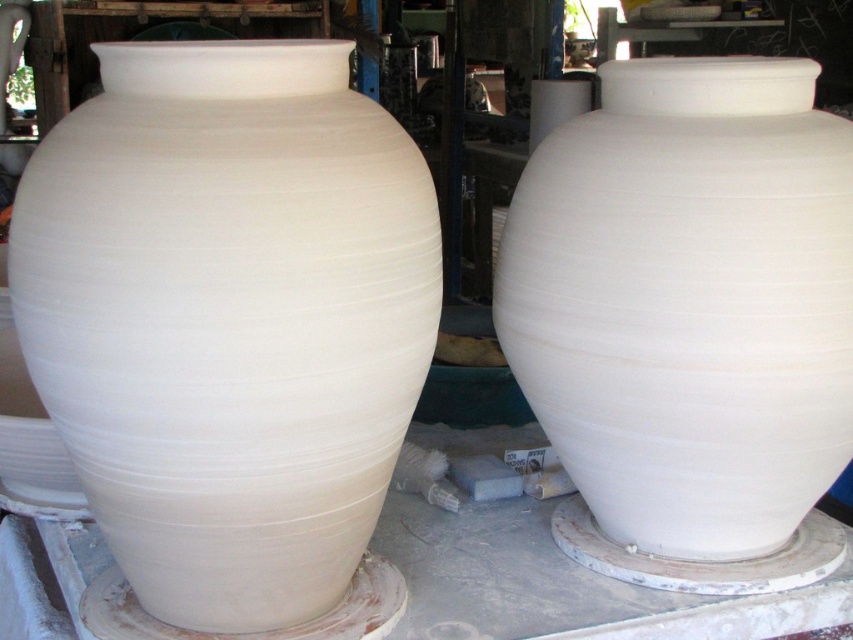
Between white clay vase at center and white matte vase at center, which one is positioned higher?

white matte vase at center

Does white clay vase at center have a lesser height compared to white matte vase at center?

No, white clay vase at center is not shorter than white matte vase at center.

This screenshot has height=640, width=853. What do you see at coordinates (228, 317) in the screenshot?
I see `white clay vase at center` at bounding box center [228, 317].

Find the location of a particular element. The width and height of the screenshot is (853, 640). white clay vase at center is located at coordinates (228, 317).